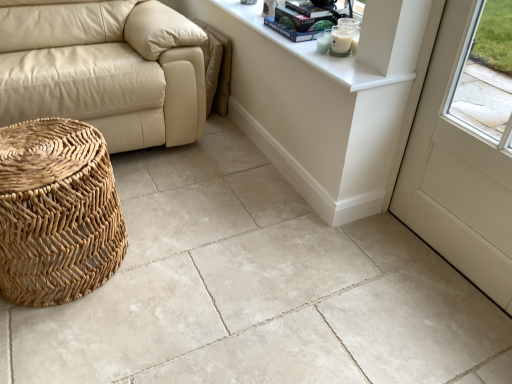
Locate an element on the screen. The width and height of the screenshot is (512, 384). beige leather couch at left is located at coordinates (105, 70).

The height and width of the screenshot is (384, 512). Describe the element at coordinates (291, 31) in the screenshot. I see `hardcover book at upper center, the first book positioned from the bottom` at that location.

I want to click on white glossy table at upper center, so click(329, 100).

Measure the distance between white glossy counter top at upper right and camera.

They are 1.40 meters apart.

Identify the location of hardcover book at upper center, the first book from the top. The image size is (512, 384). (305, 19).

What is the approximate height of natural woven basket at lower left?

natural woven basket at lower left is 18.38 inches in height.

The image size is (512, 384). What do you see at coordinates (341, 41) in the screenshot? I see `white glass candle at upper right` at bounding box center [341, 41].

Where is `white matte screen door at lower right`? Image resolution: width=512 pixels, height=384 pixels. white matte screen door at lower right is located at coordinates (457, 172).

In the scene shown: In terms of width, does natural woven basket at lower left look wider or thinner when compared to beige leather couch at left?

Clearly, natural woven basket at lower left has less width compared to beige leather couch at left.

Is natural woven basket at lower left closer to camera compared to beige leather couch at left?

Yes, natural woven basket at lower left is in front of beige leather couch at left.

Who is shorter, natural woven basket at lower left or beige leather couch at left?

With less height is natural woven basket at lower left.

From a real-world perspective, which object stands above the other?

beige leather couch at left.

The height and width of the screenshot is (384, 512). What are the coordinates of `basket in front of the white glass candle at upper right` in the screenshot? It's located at (57, 212).

From the image's perspective, is white glass candle at upper right above or below natural woven basket at lower left?

Based on their image positions, white glass candle at upper right is located above natural woven basket at lower left.

Would you say natural woven basket at lower left is part of white glass candle at upper right's contents?

No, natural woven basket at lower left is located outside of white glass candle at upper right.

Is white glass candle at upper right in front of natural woven basket at lower left?

No, the depth of white glass candle at upper right is greater than that of natural woven basket at lower left.

From the picture: Does white glossy table at upper center have a larger size compared to hardcover book at upper center, the first book positioned from the bottom?

Correct, white glossy table at upper center is larger in size than hardcover book at upper center, the first book positioned from the bottom.

Is point (280, 96) positioned after point (266, 25)?

Yes.

Which of these two, white glossy table at upper center or hardcover book at upper center, the first book positioned from the bottom, is thinner?

white glossy table at upper center.

From the image's perspective, which is above, white glossy table at upper center or hardcover book at upper center, positioned as the 2th book in top-to-bottom order?

From the image's view, hardcover book at upper center, positioned as the 2th book in top-to-bottom order, is above.

Would you say hardcover book at upper center, which is counted as the 2th book, starting from the bottom, is outside natural woven basket at lower left?

hardcover book at upper center, which is counted as the 2th book, starting from the bottom, is positioned outside natural woven basket at lower left.

At what (x,y) coordinates should I click in order to perform the action: click on the 2nd book above the natural woven basket at lower left (from a real-world perspective). Please return your answer as a coordinate pair (x, y). Looking at the image, I should click on (305, 19).

Which is nearer, (301, 35) or (42, 213)?

Point (301, 35).

Looking at this image, is hardcover book at upper center, which is counted as the 2th book, starting from the bottom, to the right of natural woven basket at lower left from the viewer's perspective?

Yes, hardcover book at upper center, which is counted as the 2th book, starting from the bottom, is to the right of natural woven basket at lower left.

Consider the image. From the image's perspective, is beige leather couch at left over white matte screen door at lower right?

A: Yes.

Consider the image. Measure the distance from beige leather couch at left to white matte screen door at lower right.

They are 1.28 meters apart.

Is point (142, 90) farther from camera compared to point (462, 16)?

Yes, point (142, 90) is farther from viewer.

Considering the relative sizes of beige leather couch at left and white matte screen door at lower right in the image provided, is beige leather couch at left shorter than white matte screen door at lower right?

Yes.

Who is shorter, hardcover book at upper center, the first book positioned from the bottom, or white matte screen door at lower right?

hardcover book at upper center, the first book positioned from the bottom.

Which object is closer to the camera taking this photo, hardcover book at upper center, positioned as the 2th book in top-to-bottom order, or white matte screen door at lower right?

white matte screen door at lower right is in front.

Where is `the 2nd book to the left when counting from the white matte screen door at lower right`? the 2nd book to the left when counting from the white matte screen door at lower right is located at coordinates coord(291,31).

Considering the sizes of objects hardcover book at upper center, the first book positioned from the bottom, and white matte screen door at lower right in the image provided, who is smaller, hardcover book at upper center, the first book positioned from the bottom, or white matte screen door at lower right?

hardcover book at upper center, the first book positioned from the bottom, is smaller.

Which is less distant, (99, 274) or (334, 51)?

Point (99, 274) appears to be closer to the viewer than point (334, 51).

Considering the sizes of objects natural woven basket at lower left and white glass candle at upper right in the image provided, who is smaller, natural woven basket at lower left or white glass candle at upper right?

Smaller between the two is white glass candle at upper right.

Between natural woven basket at lower left and white glass candle at upper right, which one appears on the left side from the viewer's perspective?

natural woven basket at lower left.

From the image's perspective, which is above, natural woven basket at lower left or white glass candle at upper right?

white glass candle at upper right.

Locate an element on the screen. This screenshot has height=384, width=512. studio couch behind the natural woven basket at lower left is located at coordinates (105, 70).

Identify the location of basket in front of the white glass candle at upper right. (57, 212).

Looking at the image, which one is located closer to white glass candle at upper right, hardcover book at upper center, the first book positioned from the bottom, or natural woven basket at lower left?

Among the two, hardcover book at upper center, the first book positioned from the bottom, is located nearer to white glass candle at upper right.

From the image, which object appears to be nearer to beige leather couch at left, white glossy counter top at upper right or white matte screen door at lower right?

The object closer to beige leather couch at left is white glossy counter top at upper right.

Estimate the real-world distances between objects in this image. Which object is further from hardcover book at upper center, which is counted as the 2th book, starting from the bottom, white glass candle at upper right or hardcover book at upper center, the first book positioned from the bottom?

white glass candle at upper right is further to hardcover book at upper center, which is counted as the 2th book, starting from the bottom.

Which object lies further to the anchor point beige leather couch at left, white glossy counter top at upper right or natural woven basket at lower left?

Among the two, white glossy counter top at upper right is located further to beige leather couch at left.

Considering their positions, is white glossy counter top at upper right positioned further to hardcover book at upper center, the first book positioned from the bottom, than white matte screen door at lower right?

white matte screen door at lower right lies further to hardcover book at upper center, the first book positioned from the bottom, than the other object.

Which object lies nearer to the anchor point white matte screen door at lower right, natural woven basket at lower left or white glass candle at upper right?

white glass candle at upper right is positioned closer to the anchor white matte screen door at lower right.

Based on their spatial positions, is white matte screen door at lower right or white glossy counter top at upper right closer to natural woven basket at lower left?

Among the two, white glossy counter top at upper right is located nearer to natural woven basket at lower left.

From the image, which object appears to be farther from hardcover book at upper center, the first book positioned from the bottom, white matte screen door at lower right or hardcover book at upper center, which is counted as the 2th book, starting from the bottom?

white matte screen door at lower right lies further to hardcover book at upper center, the first book positioned from the bottom, than the other object.

Image resolution: width=512 pixels, height=384 pixels. What are the coordinates of `candle between white glossy counter top at upper right and hardcover book at upper center, the first book from the top, from front to back` in the screenshot? It's located at (341, 41).

Where is `counter top between white matte screen door at lower right and hardcover book at upper center, the first book positioned from the bottom, in the front-back direction`? counter top between white matte screen door at lower right and hardcover book at upper center, the first book positioned from the bottom, in the front-back direction is located at coordinates (314, 52).

You are a GUI agent. You are given a task and a screenshot of the screen. Output one action in this format:
    pyautogui.click(x=<x>, y=<y>)
    Task: Click on the candle positioned between white matte screen door at lower right and hardcover book at upper center, positioned as the 2th book in top-to-bottom order, from near to far
    This screenshot has width=512, height=384.
    Given the screenshot: What is the action you would take?
    pyautogui.click(x=341, y=41)

Where is `counter top between white glossy table at upper center and white matte screen door at lower right from left to right`? The image size is (512, 384). counter top between white glossy table at upper center and white matte screen door at lower right from left to right is located at coordinates (314, 52).